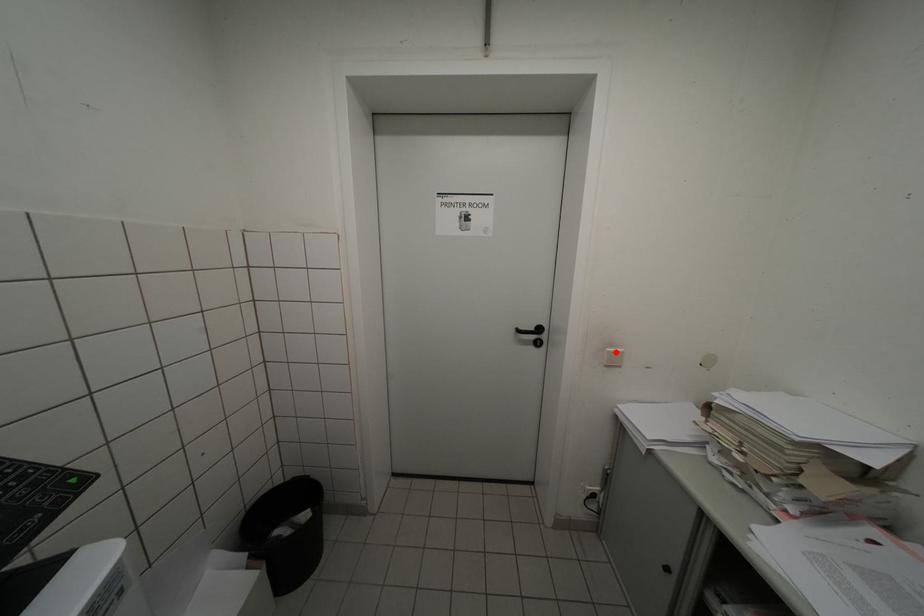
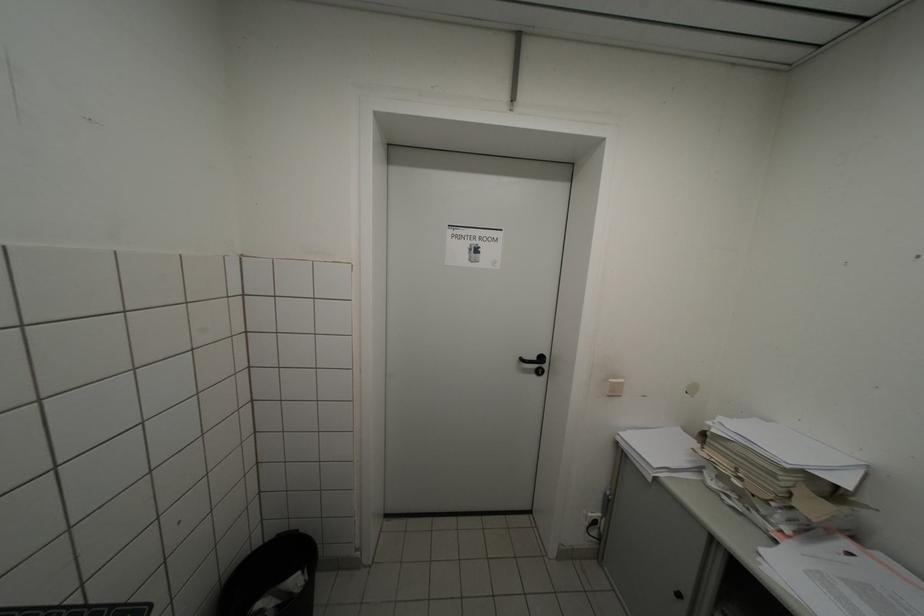
Find the pixel in the second image that matches the highlighted location in the first image.

(618, 383)